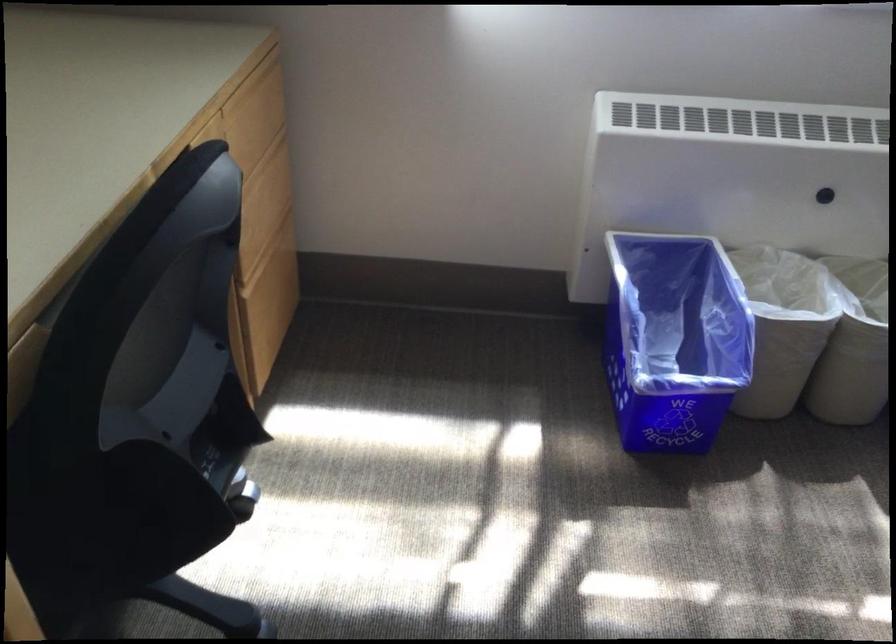
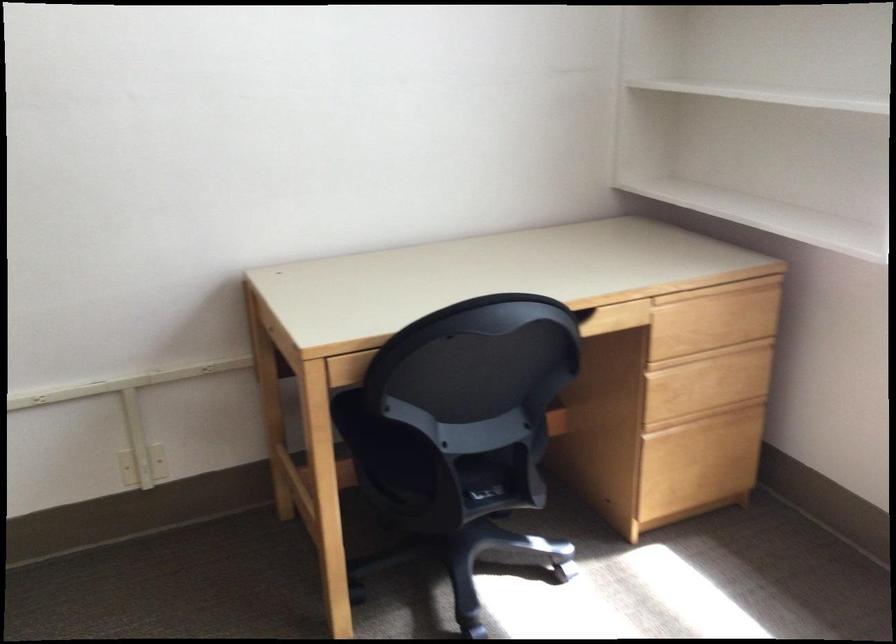
Find the pixel in the second image that matches [271,242] in the first image.

(709, 413)